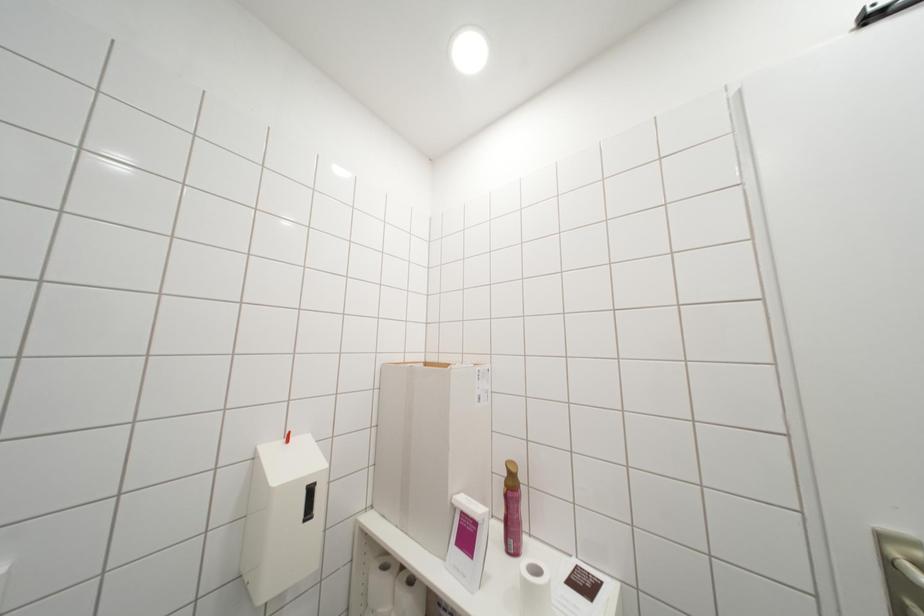
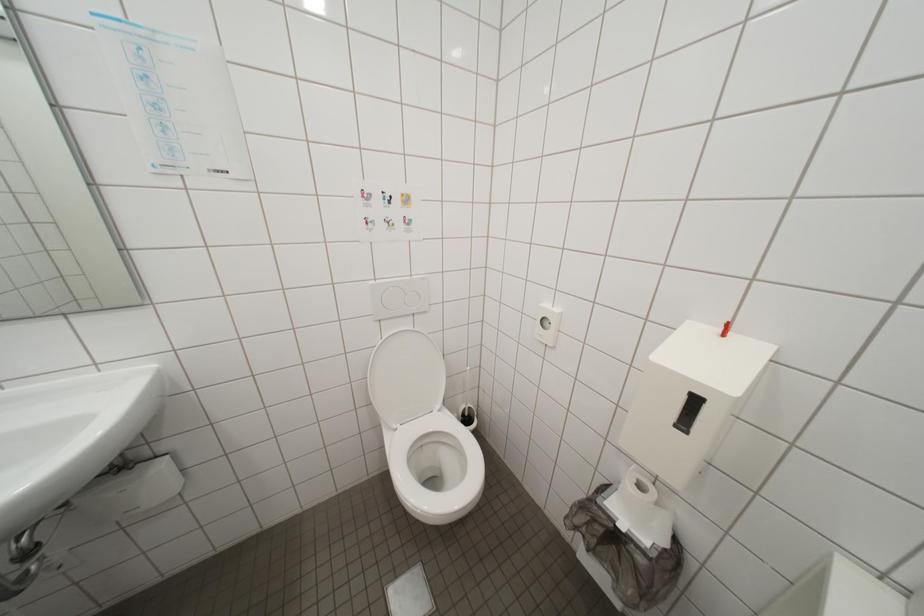
How did the camera likely rotate?

The rotation direction of the camera is left-down.